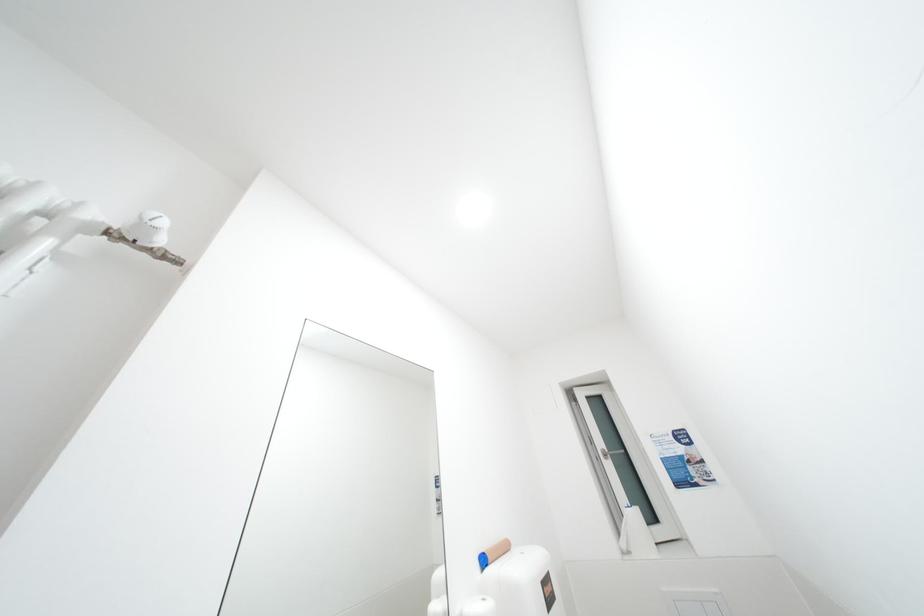
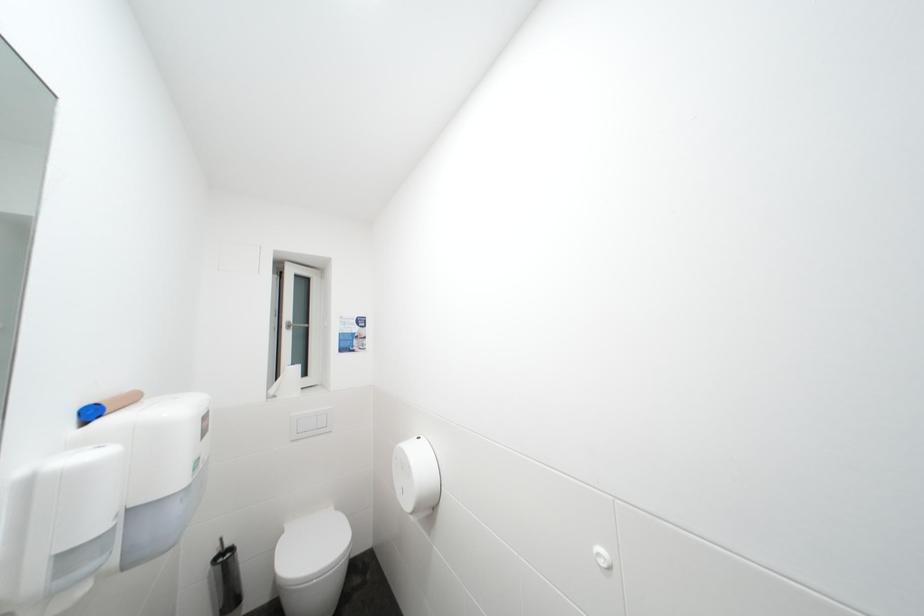
Question: The camera is either moving clockwise (left) or counter-clockwise (right) around the object. The first image is from the beginning of the video and the second image is from the end. Is the camera moving left or right when shooting the video?

Choices:
 (A) Left
 (B) Right

Answer: (A)